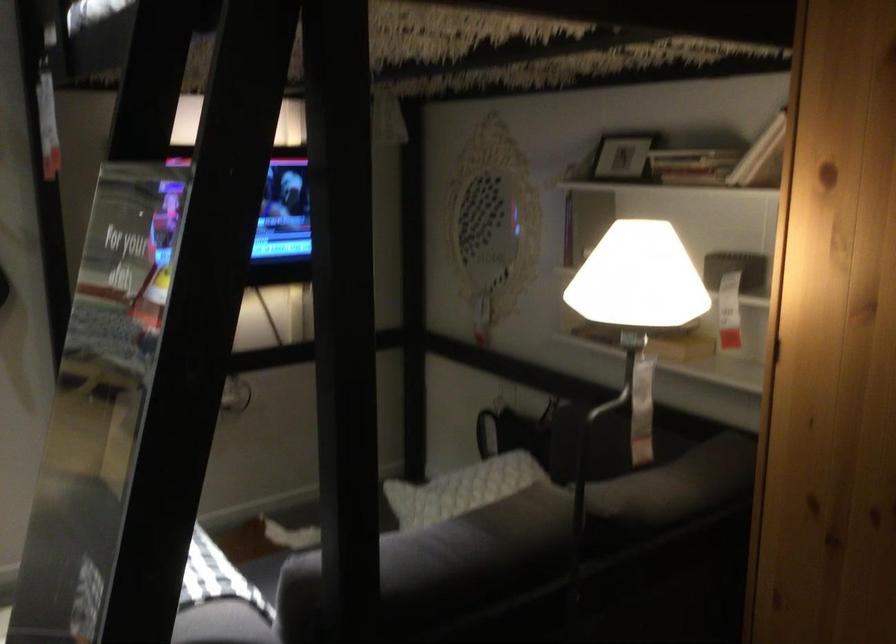
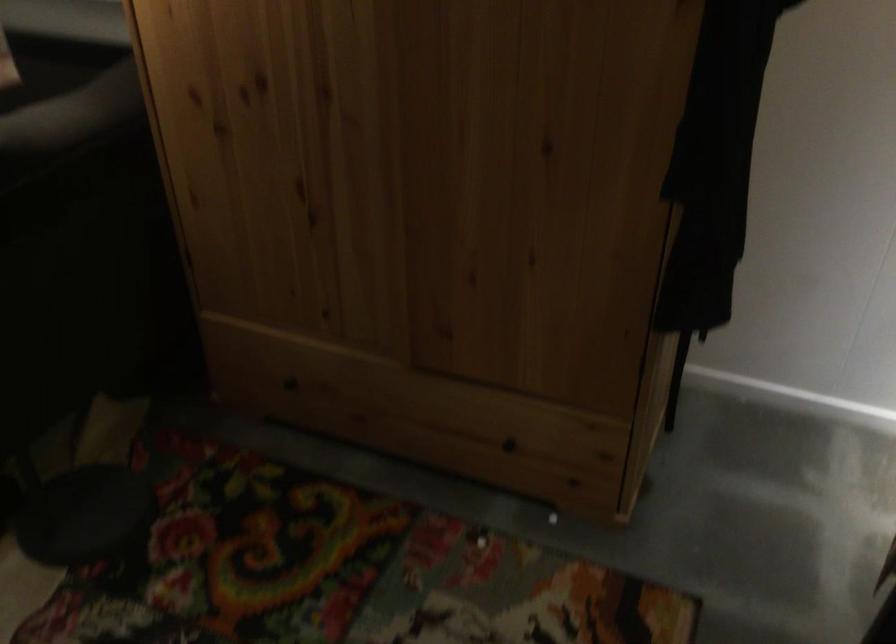
How did the camera likely rotate?

The camera's rotation is toward right-down.